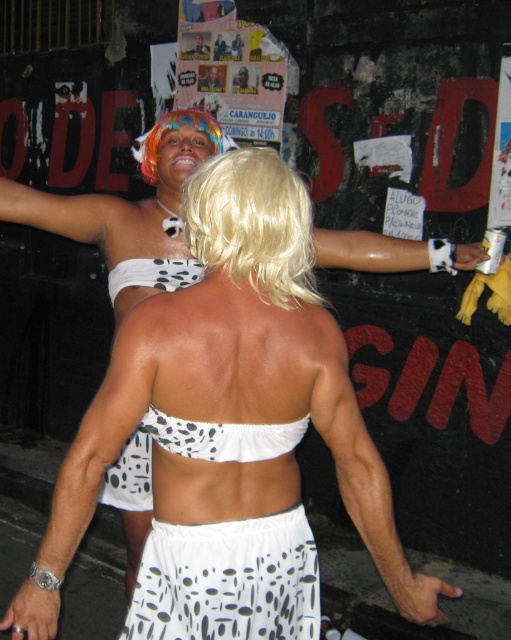
You are a fashion designer analyzing the image. You notice two white dotted fabric items. Which one is taller, the white dotted fabric skirt at lower center or the white dotted fabric at upper left?

The white dotted fabric skirt at lower center is much taller than the white dotted fabric at upper left.

You are a fashion designer observing the scene. You need to determine which piece of clothing has a bigger surface area between the white dotted fabric skirt at lower center and the white dotted fabric at upper left. Which one is it?

The white dotted fabric skirt at lower center has a larger surface area than the white dotted fabric at upper left.

You are a fashion designer observing the scene. You notice the white dotted fabric bikini top at back and the white dotted fabric at upper left. Which one has a greater width?

The white dotted fabric bikini top at back has a greater width than the white dotted fabric at upper left according to the description.